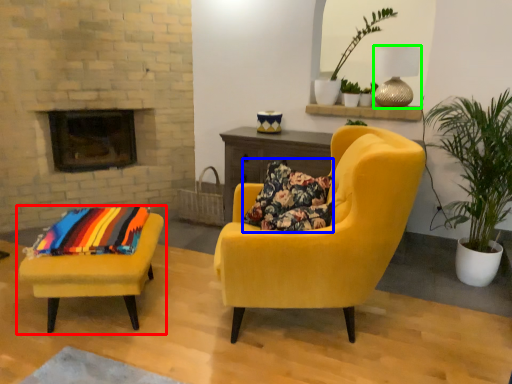
Question: Estimate the real-world distances between objects in this image. Which object is closer to chair (highlighted by a red box), pillow (highlighted by a blue box) or lamp (highlighted by a green box)?

Choices:
 (A) pillow
 (B) lamp

Answer: (A)